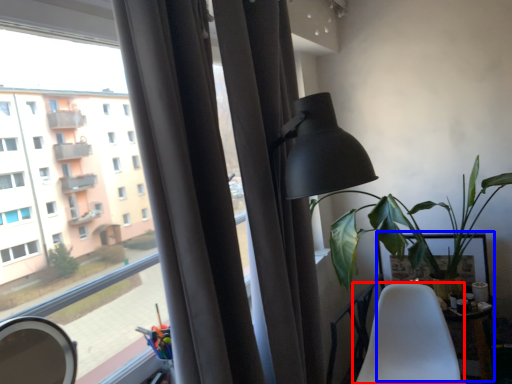
Question: Which point is further to the camera, chair (highlighted by a red box) or table (highlighted by a blue box)?

Choices:
 (A) chair
 (B) table

Answer: (B)